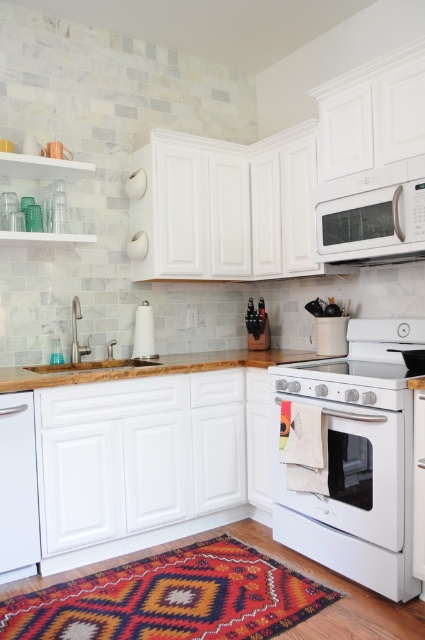
Question: Which is nearer to the wooden countertop at lower center?

Choices:
 (A) white glossy microwave at upper right
 (B) white glossy oven at center

Answer: (B)

Question: Can you confirm if white glossy stove at lower right is positioned below white glossy oven at center?

Choices:
 (A) no
 (B) yes

Answer: (B)

Question: Which object is the farthest from the white glossy oven at center?

Choices:
 (A) wooden countertop at lower center
 (B) white glossy microwave at upper center
 (C) wooden sink at lower left
 (D) white matte dishwasher at lower left

Answer: (D)

Question: Which of these objects is positioned farthest from the wooden sink at lower left?

Choices:
 (A) white glossy stove at lower right
 (B) white glossy oven at center
 (C) wooden countertop at lower center

Answer: (B)

Question: Does white glossy stove at lower right have a smaller size compared to white glossy oven at center?

Choices:
 (A) yes
 (B) no

Answer: (B)

Question: Does white glossy oven at center have a larger size compared to white glossy microwave at upper right?

Choices:
 (A) no
 (B) yes

Answer: (B)